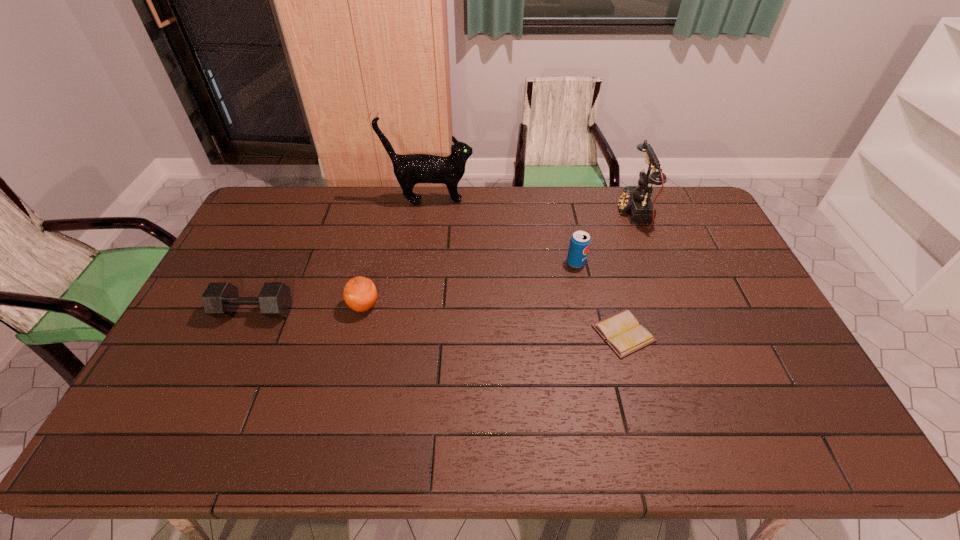
Locate an element on the screen. free space between the rightmost object and the soda can is located at coordinates (605, 238).

Identify the location of vacant area that lies between the diary and the third farthest object. This screenshot has width=960, height=540. (600, 298).

Select which object is the fourth closest to the cat. Please provide its 2D coordinates. Your answer should be formatted as a tuple, i.e. [(x, y)], where the tuple contains the x and y coordinates of a point satisfying the conditions above.

[(635, 200)]

Locate which object is the second closest to the third farthest object. Please provide its 2D coordinates. Your answer should be formatted as a tuple, i.e. [(x, y)], where the tuple contains the x and y coordinates of a point satisfying the conditions above.

[(635, 200)]

I want to click on blank space that satisfies the following two spatial constraints: 1. on the face of the soda can; 2. on the right side of the tallest object, so click(x=421, y=263).

Find the location of a particular element. free space that satisfies the following two spatial constraints: 1. on the back side of the orange; 2. on the left side of the dumbbell is located at coordinates (256, 306).

This screenshot has height=540, width=960. Identify the location of vacant space that satisfies the following two spatial constraints: 1. on the back side of the soda can; 2. on the left side of the leftmost object. (276, 263).

Locate an element on the screen. vacant space that satisfies the following two spatial constraints: 1. on the face of the cat; 2. on the right side of the diary is located at coordinates (412, 334).